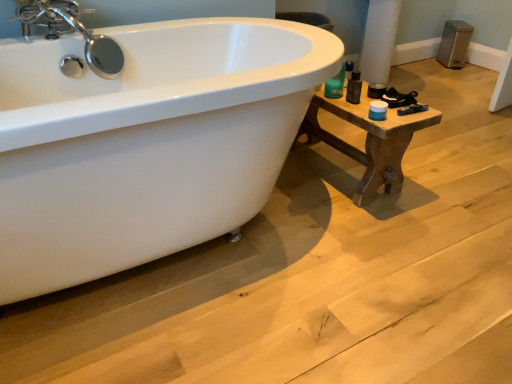
Question: Can you confirm if chrome/metallic faucet at upper left is bigger than brown wooden table at right?

Choices:
 (A) no
 (B) yes

Answer: (A)

Question: Is chrome/metallic faucet at upper left at the left side of brown wooden table at right?

Choices:
 (A) yes
 (B) no

Answer: (A)

Question: Can you confirm if chrome/metallic faucet at upper left is shorter than brown wooden table at right?

Choices:
 (A) yes
 (B) no

Answer: (A)

Question: Is chrome/metallic faucet at upper left smaller than brown wooden table at right?

Choices:
 (A) no
 (B) yes

Answer: (B)

Question: From a real-world perspective, does chrome/metallic faucet at upper left stand above brown wooden table at right?

Choices:
 (A) no
 (B) yes

Answer: (B)

Question: From the image's perspective, is chrome/metallic faucet at upper left above brown wooden table at right?

Choices:
 (A) no
 (B) yes

Answer: (B)

Question: Could you tell me if chrome/metallic faucet at upper left is facing matte black container at right?

Choices:
 (A) no
 (B) yes

Answer: (A)

Question: From a real-world perspective, is chrome/metallic faucet at upper left positioned under matte black container at right based on gravity?

Choices:
 (A) no
 (B) yes

Answer: (A)

Question: From the image's perspective, would you say chrome/metallic faucet at upper left is shown under matte black container at right?

Choices:
 (A) yes
 (B) no

Answer: (B)

Question: From a real-world perspective, is chrome/metallic faucet at upper left on top of matte black container at right?

Choices:
 (A) yes
 (B) no

Answer: (A)

Question: Considering the relative positions of chrome/metallic faucet at upper left and matte black container at right in the image provided, is chrome/metallic faucet at upper left to the left of matte black container at right from the viewer's perspective?

Choices:
 (A) yes
 (B) no

Answer: (A)

Question: Is chrome/metallic faucet at upper left taller than matte black container at right?

Choices:
 (A) no
 (B) yes

Answer: (B)

Question: Would you say matte black container at right is outside brown wooden table at right?

Choices:
 (A) no
 (B) yes

Answer: (B)